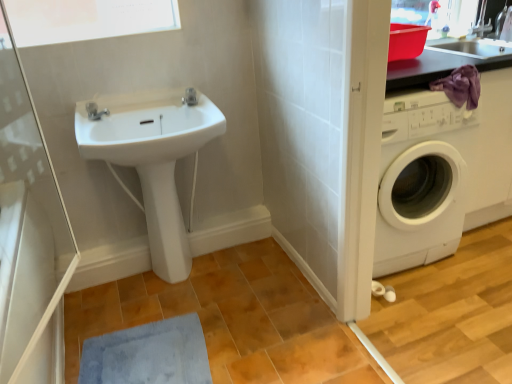
Question: Is white glossy sink at center in contact with satin chrome faucet at upper center, which ranks as the first tap in right-to-left order?

Choices:
 (A) yes
 (B) no

Answer: (B)

Question: Can you confirm if white glossy sink at center is wider than satin chrome faucet at upper center, positioned as the 2th tap in front-to-back order?

Choices:
 (A) yes
 (B) no

Answer: (A)

Question: Is white glossy sink at center far from satin chrome faucet at upper center, acting as the 1th tap starting from the back?

Choices:
 (A) no
 (B) yes

Answer: (A)

Question: From a real-world perspective, does white glossy sink at center stand above satin chrome faucet at upper center, acting as the 1th tap starting from the back?

Choices:
 (A) yes
 (B) no

Answer: (B)

Question: Does white glossy sink at center have a greater height compared to satin chrome faucet at upper center, acting as the second tap starting from the left?

Choices:
 (A) yes
 (B) no

Answer: (A)

Question: From the image's perspective, is white glossy sink at center located above satin chrome faucet at upper center, the 2th tap when ordered from bottom to top?

Choices:
 (A) no
 (B) yes

Answer: (A)

Question: Can you confirm if transparent glass screen door at upper left is wider than satin chrome faucet at upper center, acting as the second tap starting from the left?

Choices:
 (A) yes
 (B) no

Answer: (B)

Question: Is transparent glass screen door at upper left further to camera compared to satin chrome faucet at upper center, which ranks as the first tap in right-to-left order?

Choices:
 (A) no
 (B) yes

Answer: (A)

Question: Is transparent glass screen door at upper left not within satin chrome faucet at upper center, which ranks as the first tap in right-to-left order?

Choices:
 (A) no
 (B) yes

Answer: (B)

Question: Does transparent glass screen door at upper left have a greater height compared to satin chrome faucet at upper center, acting as the second tap starting from the left?

Choices:
 (A) yes
 (B) no

Answer: (A)

Question: From a real-world perspective, is transparent glass screen door at upper left positioned over satin chrome faucet at upper center, acting as the 1th tap starting from the back, based on gravity?

Choices:
 (A) no
 (B) yes

Answer: (B)

Question: Is transparent glass screen door at upper left bigger than satin chrome faucet at upper center, positioned as the 2th tap in front-to-back order?

Choices:
 (A) no
 (B) yes

Answer: (B)

Question: Is white glossy sink at center bigger than blue soft bath mat at lower left?

Choices:
 (A) no
 (B) yes

Answer: (B)